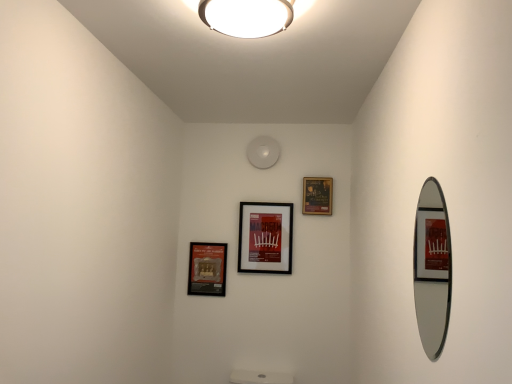
Question: From the image's perspective, is matte black picture frame at center, placed as the second picture frame when sorted from right to left, located beneath matte black picture frame at lower left, placed as the 1th picture frame when sorted from left to right?

Choices:
 (A) no
 (B) yes

Answer: (A)

Question: Is matte black picture frame at center, placed as the second picture frame when sorted from right to left, not inside matte black picture frame at lower left, placed as the 1th picture frame when sorted from left to right?

Choices:
 (A) yes
 (B) no

Answer: (A)

Question: Could you tell me if matte black picture frame at center, placed as the second picture frame when sorted from right to left, is facing matte black picture frame at lower left, placed as the third picture frame when sorted from right to left?

Choices:
 (A) yes
 (B) no

Answer: (B)

Question: Is matte black picture frame at lower left, placed as the third picture frame when sorted from right to left, a part of matte black picture frame at center, placed as the second picture frame when sorted from right to left?

Choices:
 (A) no
 (B) yes

Answer: (A)

Question: Is matte black picture frame at center, placed as the second picture frame when sorted from right to left, thinner than matte black picture frame at lower left, placed as the 1th picture frame when sorted from left to right?

Choices:
 (A) yes
 (B) no

Answer: (B)

Question: Is matte black picture frame at center, the 2th picture frame viewed from the left, turned away from matte black picture frame at lower left, placed as the third picture frame when sorted from right to left?

Choices:
 (A) yes
 (B) no

Answer: (B)

Question: Is matte black picture frame at lower left, placed as the third picture frame when sorted from right to left, not near matte black picture frame at center, the 2th picture frame viewed from the left?

Choices:
 (A) yes
 (B) no

Answer: (B)

Question: Is matte black picture frame at lower left, placed as the third picture frame when sorted from right to left, next to matte black picture frame at center, the 2th picture frame viewed from the left, and touching it?

Choices:
 (A) no
 (B) yes

Answer: (A)

Question: Does matte black picture frame at lower left, placed as the third picture frame when sorted from right to left, have a greater height compared to matte black picture frame at center, the 2th picture frame viewed from the left?

Choices:
 (A) no
 (B) yes

Answer: (A)

Question: Does matte black picture frame at lower left, placed as the third picture frame when sorted from right to left, have a lesser height compared to matte black picture frame at center, placed as the second picture frame when sorted from right to left?

Choices:
 (A) no
 (B) yes

Answer: (B)

Question: Considering the relative sizes of matte black picture frame at lower left, placed as the 1th picture frame when sorted from left to right, and matte black picture frame at center, the 2th picture frame viewed from the left, in the image provided, is matte black picture frame at lower left, placed as the 1th picture frame when sorted from left to right, wider than matte black picture frame at center, the 2th picture frame viewed from the left,?

Choices:
 (A) yes
 (B) no

Answer: (B)

Question: Is matte black picture frame at lower left, placed as the 1th picture frame when sorted from left to right, thinner than matte black picture frame at center, placed as the second picture frame when sorted from right to left?

Choices:
 (A) no
 (B) yes

Answer: (B)

Question: Can you see white glossy ceiling light at upper center touching matte black picture frame at center, the 2th picture frame viewed from the left?

Choices:
 (A) yes
 (B) no

Answer: (B)